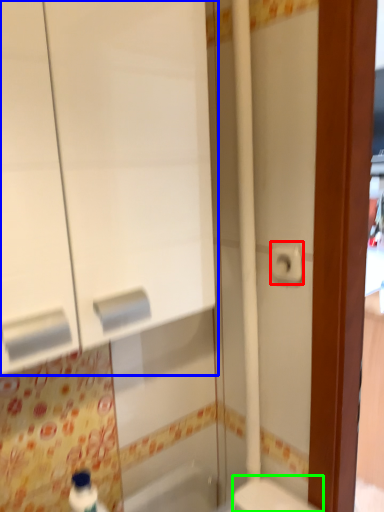
Question: Estimate the real-world distances between objects in this image. Which object is farther from toilet paper (highlighted by a red box), medicine cabinet (highlighted by a blue box) or toilet (highlighted by a green box)?

Choices:
 (A) medicine cabinet
 (B) toilet

Answer: (B)